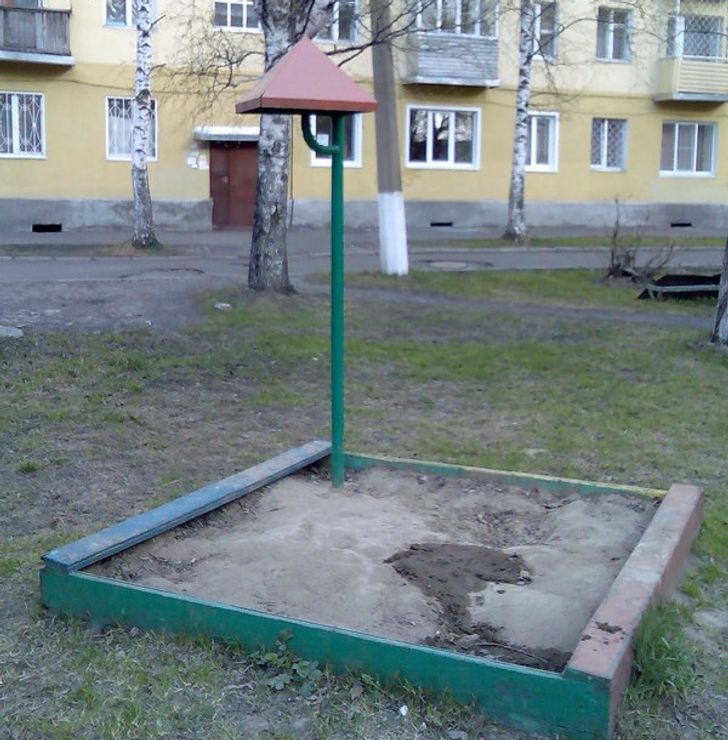
The height and width of the screenshot is (740, 728). Identify the location of brown wooden entrance door. (244, 163).